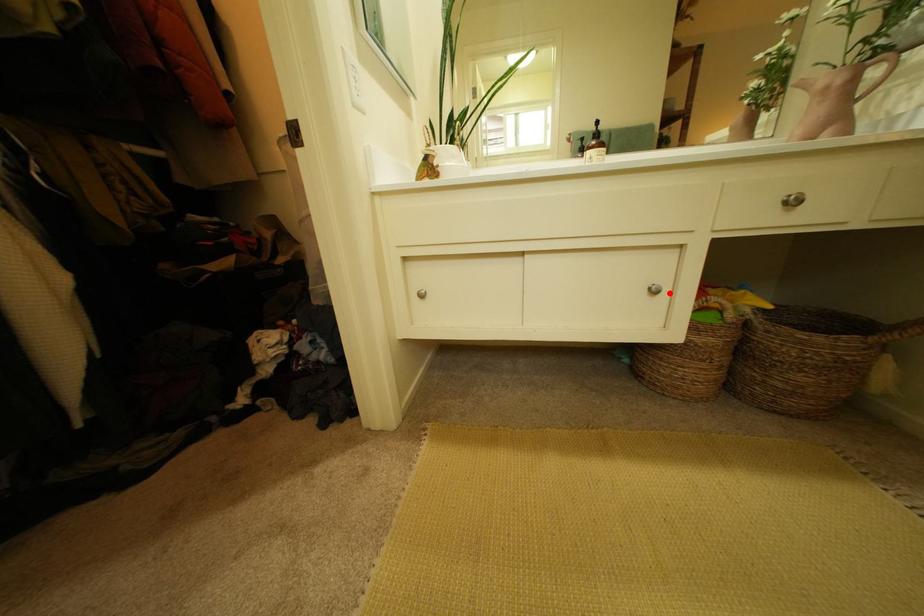
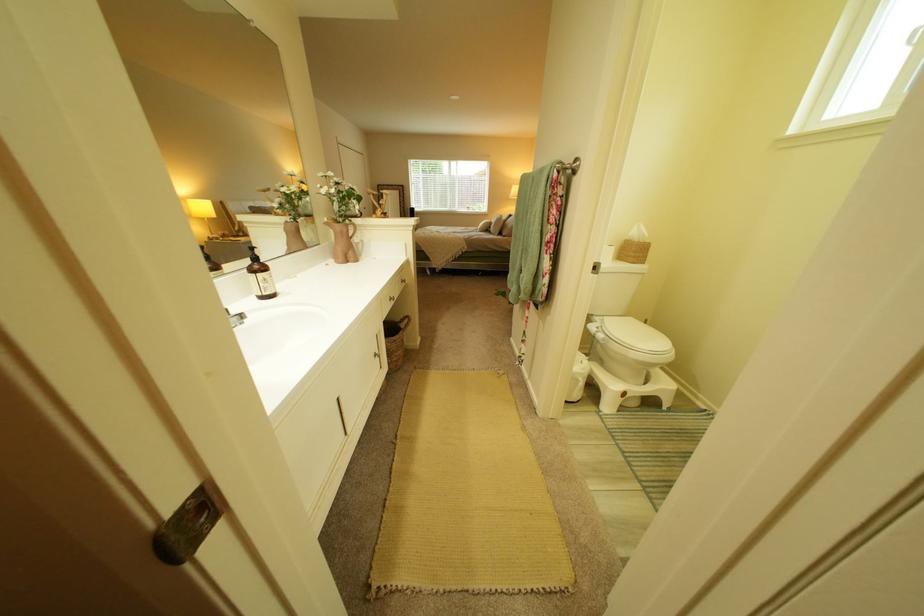
Where in the second image is the point corresponding to the highlighted location from the first image?

(391, 357)